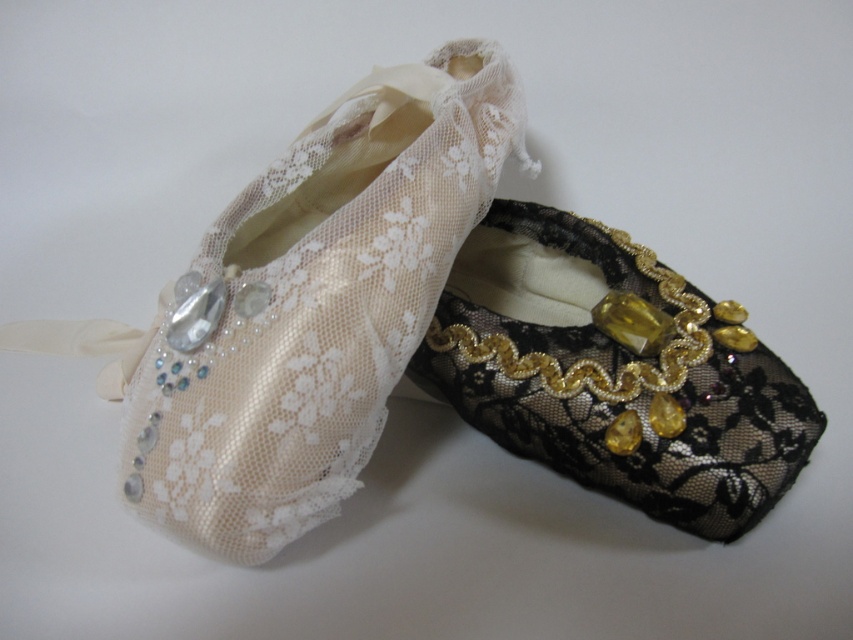
Which is in front, point (390, 381) or point (689, 424)?

Point (689, 424) is more forward.

Measure the distance between ivory lace slipper at left and black lace slipper at right.

A distance of 9.27 inches exists between ivory lace slipper at left and black lace slipper at right.

Between point (384, 419) and point (463, 419), which one is positioned behind?

Positioned behind is point (463, 419).

Locate an element on the screen. Image resolution: width=853 pixels, height=640 pixels. ivory lace slipper at left is located at coordinates (305, 307).